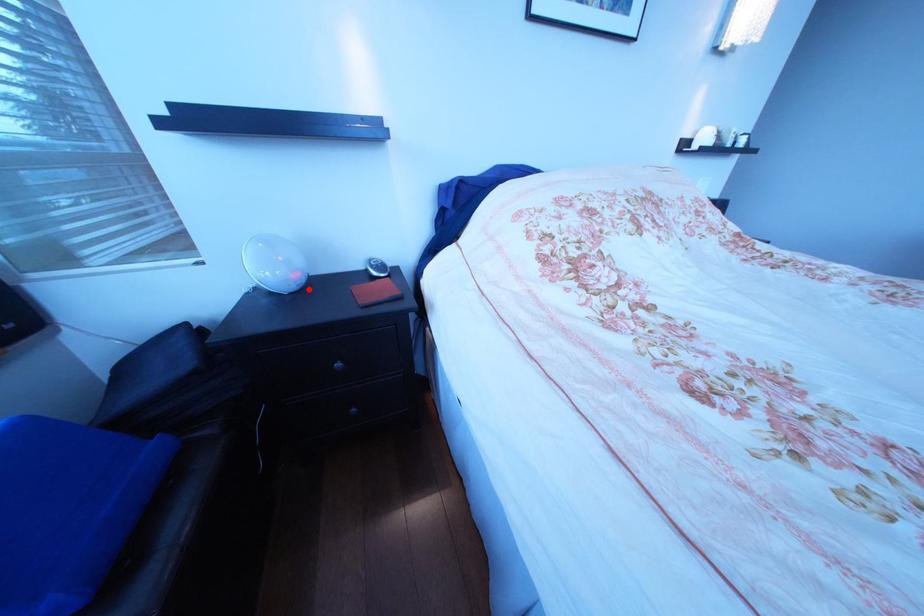
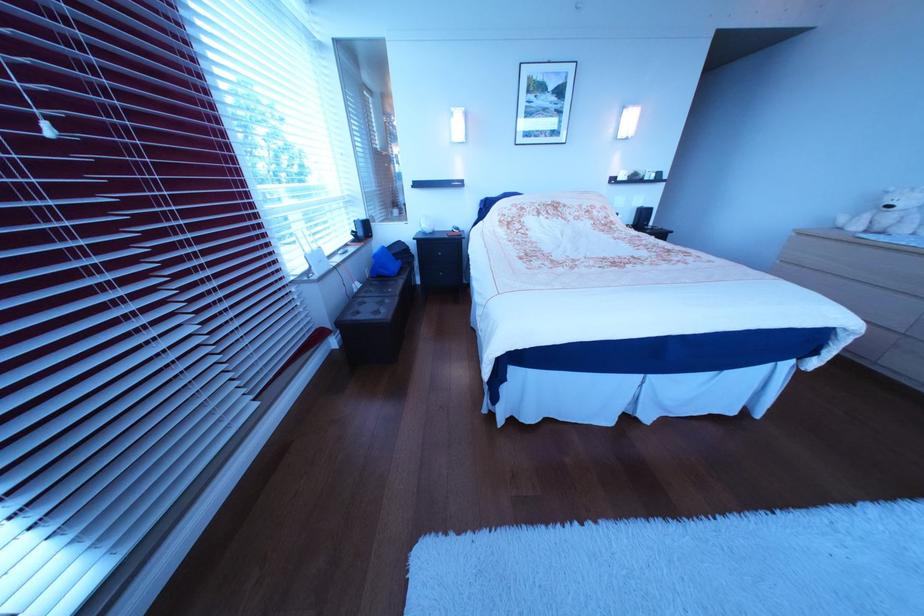
Locate, in the second image, the point that corresponds to the highlighted location in the first image.

(445, 233)